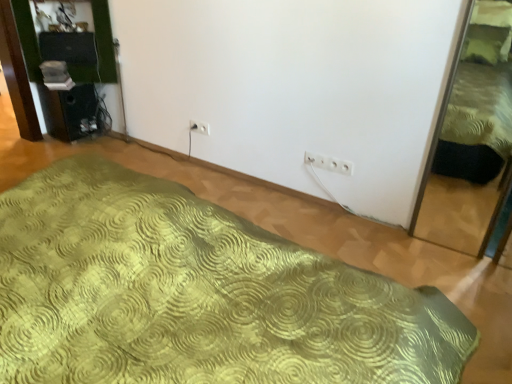
Question: Is green textured bed at right, the first bed from the right, positioned with its back to white plastic electric outlet at center, which appears as the second electric outlet when viewed from the left?

Choices:
 (A) yes
 (B) no

Answer: (B)

Question: From a real-world perspective, is green textured bed at right, which is counted as the 2th bed, starting from the left, on top of white plastic electric outlet at center, placed as the 2th electric outlet when sorted from top to bottom?

Choices:
 (A) yes
 (B) no

Answer: (A)

Question: Considering the relative positions of green textured bed at right, which is counted as the 2th bed, starting from the left, and white plastic electric outlet at center, placed as the 2th electric outlet when sorted from top to bottom, in the image provided, is green textured bed at right, which is counted as the 2th bed, starting from the left, in front of white plastic electric outlet at center, placed as the 2th electric outlet when sorted from top to bottom,?

Choices:
 (A) no
 (B) yes

Answer: (B)

Question: Are green textured bed at right, the first bed from the right, and white plastic electric outlet at center, which appears as the second electric outlet when viewed from the left, located far from each other?

Choices:
 (A) yes
 (B) no

Answer: (B)

Question: Is the position of green textured bed at right, which is counted as the 2th bed, starting from the left, more distant than that of white plastic electric outlet at center, which is counted as the first electric outlet, starting from the bottom?

Choices:
 (A) no
 (B) yes

Answer: (A)

Question: From a real-world perspective, is green textured bed at right, which is counted as the 2th bed, starting from the left, under white plastic electric outlet at center, which appears as the second electric outlet when viewed from the left?

Choices:
 (A) yes
 (B) no

Answer: (B)

Question: Is white plastic electric outlet at center, placed as the 2th electric outlet when sorted from top to bottom, oriented towards green textured bed at right, the first bed from the right?

Choices:
 (A) yes
 (B) no

Answer: (B)

Question: Does white plastic electric outlet at center, which appears as the second electric outlet when viewed from the left, appear on the left side of green textured bed at right, which is counted as the 2th bed, starting from the left?

Choices:
 (A) no
 (B) yes

Answer: (B)

Question: From a real-world perspective, is white plastic electric outlet at center, placed as the 2th electric outlet when sorted from top to bottom, positioned over green textured bed at right, which is counted as the 2th bed, starting from the left, based on gravity?

Choices:
 (A) no
 (B) yes

Answer: (A)

Question: Is white plastic electric outlet at center, which is counted as the first electric outlet, starting from the bottom, turned away from green textured bed at right, which is counted as the 2th bed, starting from the left?

Choices:
 (A) yes
 (B) no

Answer: (B)

Question: Is white plastic electric outlet at center, which is counted as the 2th electric outlet, starting from the back, in front of green textured bed at right, the first bed from the right?

Choices:
 (A) no
 (B) yes

Answer: (A)

Question: Is white plastic electric outlet at center, placed as the 2th electric outlet when sorted from top to bottom, not inside green textured bed at right, the first bed from the right?

Choices:
 (A) no
 (B) yes

Answer: (B)

Question: Does white plastic electric outlet at center, which is the first electric outlet in back-to-front order, turn towards green textured bed at right, the first bed from the right?

Choices:
 (A) no
 (B) yes

Answer: (A)